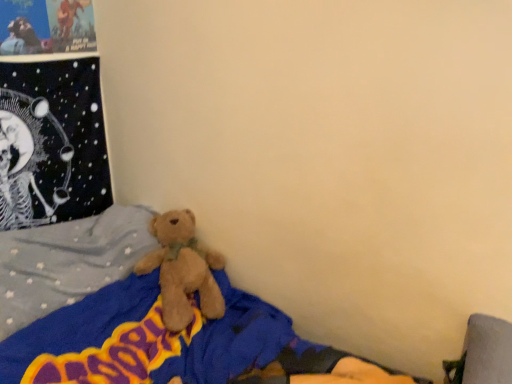
The image size is (512, 384). What do you see at coordinates (172, 342) in the screenshot?
I see `brown plush bear at lower left` at bounding box center [172, 342].

Where is `brown plush bear at lower left`? The image size is (512, 384). brown plush bear at lower left is located at coordinates (172, 342).

Find the location of `brown plush bear at lower left`. brown plush bear at lower left is located at coordinates (172, 342).